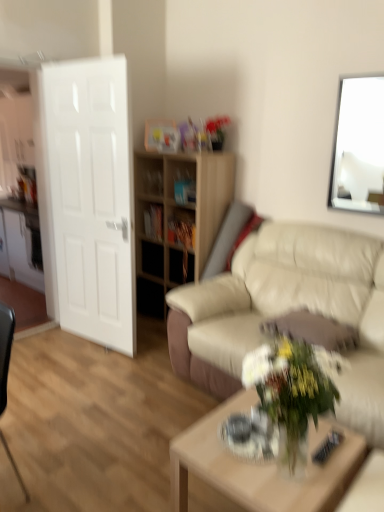
You are a GUI agent. You are given a task and a screenshot of the screen. Output one action in this format:
    pyautogui.click(x=<x>, y=<y>)
    Task: Click on the vacant space in white glossy vase at lower center (from a real-world perspective)
    The width and height of the screenshot is (384, 512).
    Given the screenshot: What is the action you would take?
    pyautogui.click(x=302, y=480)